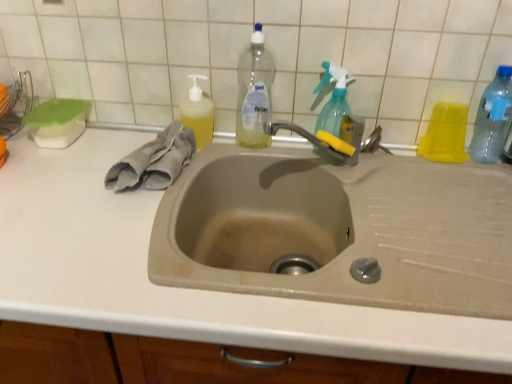
Question: Should I look upward or downward to see gray cotton hand towel at left?

Choices:
 (A) down
 (B) up

Answer: (B)

Question: Is yellow translucent liquid at upper left, marked as the first cleaning product in a left-to-right arrangement, closer to the viewer compared to white tile at upper center?

Choices:
 (A) yes
 (B) no

Answer: (B)

Question: From the image's perspective, is yellow translucent liquid at upper left, which is the second cleaning product in right-to-left order, on white tile at upper center?

Choices:
 (A) no
 (B) yes

Answer: (A)

Question: Would you say yellow translucent liquid at upper left, which is the second cleaning product in right-to-left order, contains white tile at upper center?

Choices:
 (A) yes
 (B) no

Answer: (B)

Question: Is yellow translucent liquid at upper left, marked as the first cleaning product in a left-to-right arrangement, at the left side of white tile at upper center?

Choices:
 (A) no
 (B) yes

Answer: (B)

Question: Can you confirm if yellow translucent liquid at upper left, which is the second cleaning product in right-to-left order, is shorter than white tile at upper center?

Choices:
 (A) no
 (B) yes

Answer: (B)

Question: Is yellow translucent liquid at upper left, marked as the first cleaning product in a left-to-right arrangement, positioned far away from white tile at upper center?

Choices:
 (A) no
 (B) yes

Answer: (A)

Question: From the image's perspective, is transparent plastic bottle at right, the third bottle when ordered from left to right, under clear plastic bottle at upper center, which is the 1th bottle from left to right?

Choices:
 (A) yes
 (B) no

Answer: (A)

Question: Is transparent plastic bottle at right, the third bottle when ordered from left to right, next to clear plastic bottle at upper center, which is the 1th bottle from left to right, and touching it?

Choices:
 (A) no
 (B) yes

Answer: (A)

Question: From a real-world perspective, is transparent plastic bottle at right, which appears as the first bottle when viewed from the right, located higher than clear plastic bottle at upper center, which is the 1th bottle from left to right?

Choices:
 (A) no
 (B) yes

Answer: (A)

Question: From a real-world perspective, is transparent plastic bottle at right, the third bottle when ordered from left to right, under clear plastic bottle at upper center, arranged as the 3th bottle when viewed from the right?

Choices:
 (A) no
 (B) yes

Answer: (B)

Question: Is the depth of transparent plastic bottle at right, which appears as the first bottle when viewed from the right, greater than that of clear plastic bottle at upper center, which is the 1th bottle from left to right?

Choices:
 (A) no
 (B) yes

Answer: (B)

Question: Considering the relative sizes of transparent plastic bottle at right, which appears as the first bottle when viewed from the right, and clear plastic bottle at upper center, arranged as the 3th bottle when viewed from the right, in the image provided, is transparent plastic bottle at right, which appears as the first bottle when viewed from the right, thinner than clear plastic bottle at upper center, arranged as the 3th bottle when viewed from the right,?

Choices:
 (A) no
 (B) yes

Answer: (B)

Question: Can you confirm if yellow rubber tap at upper center is positioned to the left of yellow translucent liquid at upper left, which is the second cleaning product in right-to-left order?

Choices:
 (A) no
 (B) yes

Answer: (A)